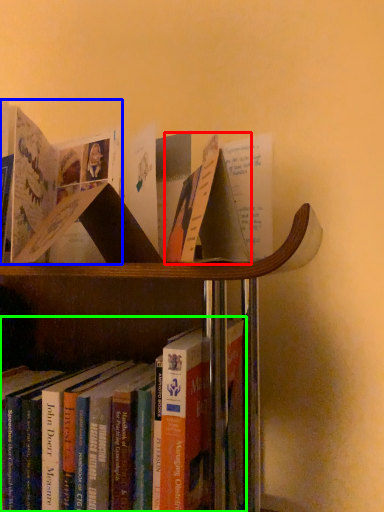
Question: Which object is the farthest from paperback book (highlighted by a red box)? Choose among these: book (highlighted by a blue box) or book (highlighted by a green box).

Choices:
 (A) book
 (B) book

Answer: (A)